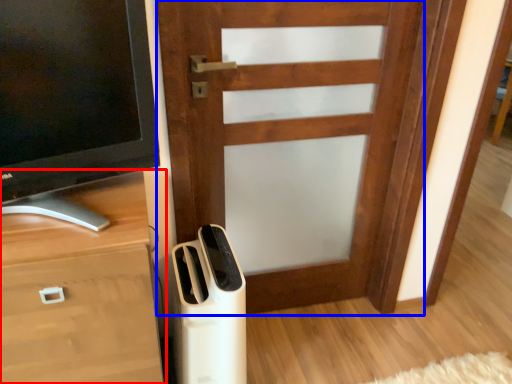
Question: Which of the following is the farthest to the observer, chest of drawers (highlighted by a red box) or door (highlighted by a blue box)?

Choices:
 (A) chest of drawers
 (B) door

Answer: (B)